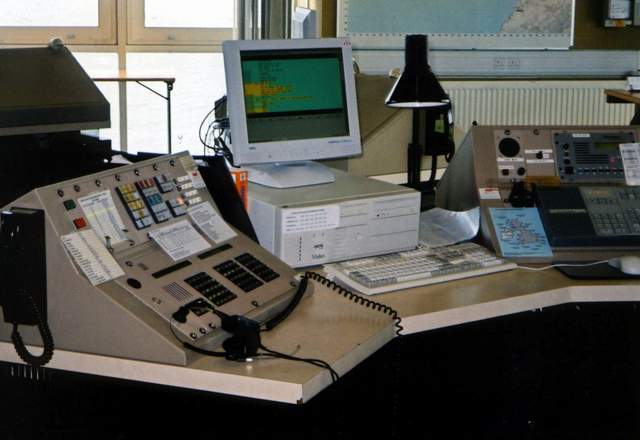
Find the location of a particular element. The width and height of the screenshot is (640, 440). computer mouse is located at coordinates (625, 266).